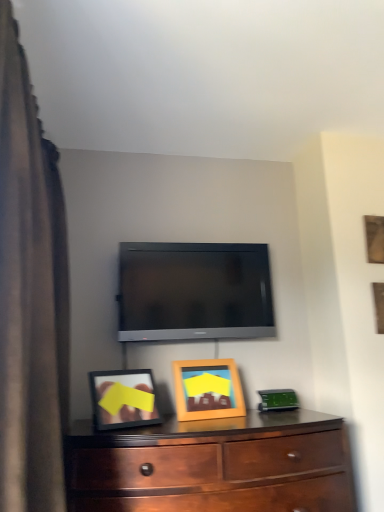
Question: Considering the positions of point (198, 297) and point (26, 284), is point (198, 297) closer or farther from the camera than point (26, 284)?

Choices:
 (A) farther
 (B) closer

Answer: (A)

Question: Do you think matte black tv at center is within brown fabric curtain at left, or outside of it?

Choices:
 (A) inside
 (B) outside

Answer: (B)

Question: Estimate the real-world distances between objects in this image. Which object is closer to the brown fabric curtain at left?

Choices:
 (A) matte black tv at center
 (B) mahogany wood dresser at lower center
 (C) wooden picture frame at center, marked as the second picture frame in a back-to-front arrangement
 (D) wooden picture frame at upper right, which is the second picture frame in left-to-right order

Answer: (B)

Question: Estimate the real-world distances between objects in this image. Which object is farther from the mahogany wood dresser at lower center?

Choices:
 (A) wooden picture frame at center, positioned as the second picture frame in top-to-bottom order
 (B) wooden picture frame at upper right, acting as the 1th picture frame starting from the right
 (C) matte black tv at center
 (D) brown fabric curtain at left

Answer: (B)